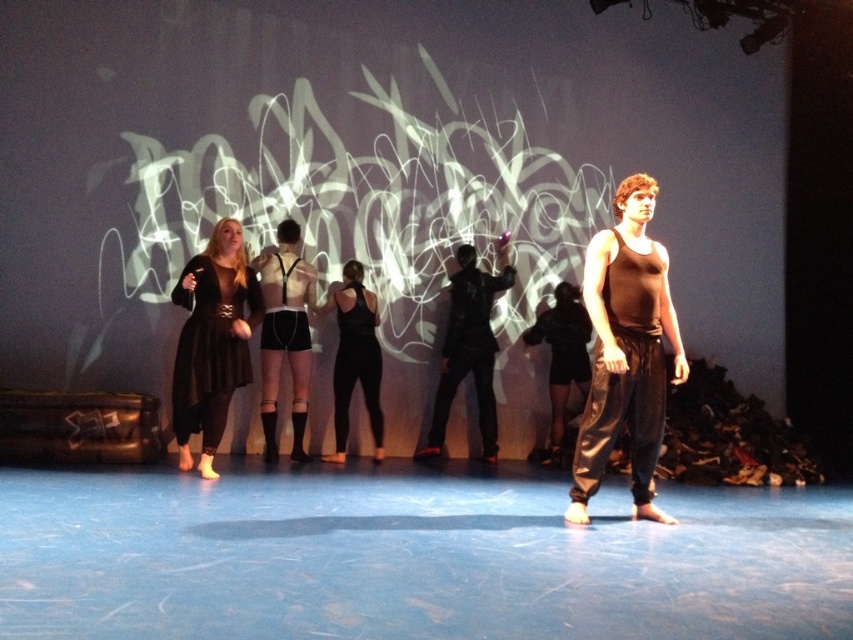
Is point (207, 388) less distant than point (305, 380)?

Yes.

Is point (229, 273) positioned behind point (271, 257)?

No, (229, 273) is closer to viewer.

What are the coordinates of `matte black dress at left` in the screenshot? It's located at 212,340.

In the scene shown: Does matte black shorts at center have a lesser width compared to black matte pants at center?

Correct, matte black shorts at center's width is less than black matte pants at center's.

At what (x,y) coordinates should I click in order to perform the action: click on matte black shorts at center. Please return your answer as a coordinate pair (x, y). Looking at the image, I should click on (285, 336).

Can you confirm if brown matte tank top at center is positioned to the right of black matte tank top at center?

Correct, you'll find brown matte tank top at center to the right of black matte tank top at center.

Is point (647, 289) farther from camera compared to point (328, 307)?

No, (647, 289) is closer to viewer.

The image size is (853, 640). Find the location of `brown matte tank top at center`. brown matte tank top at center is located at coordinates (625, 349).